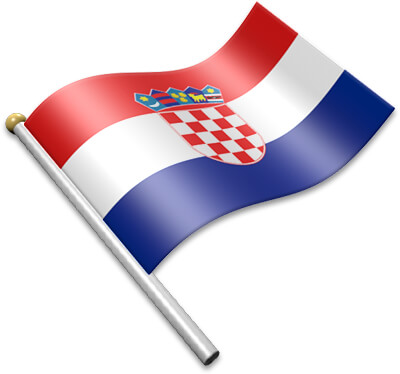
The height and width of the screenshot is (374, 400). Find the location of `rod`. rod is located at coordinates (168, 314).